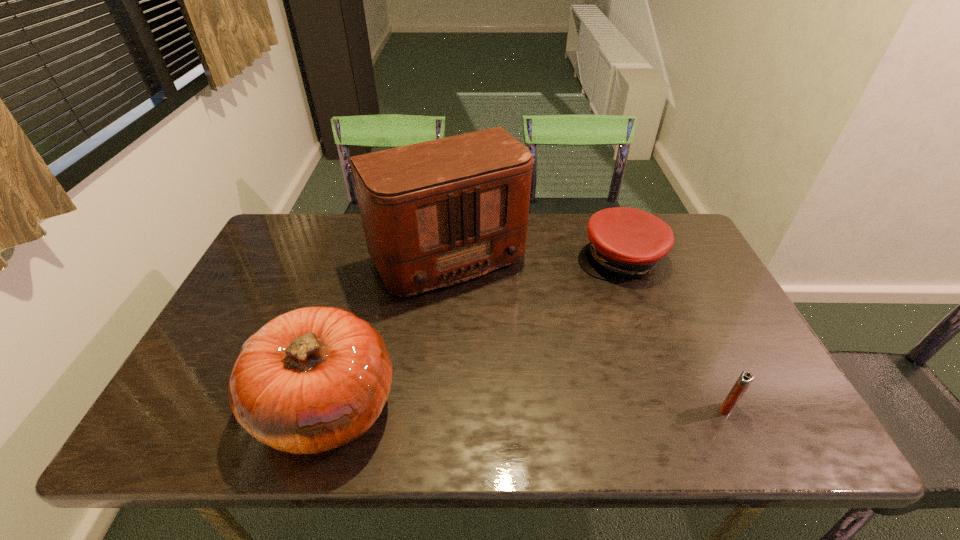
This screenshot has height=540, width=960. What are the coordinates of `pumpkin` in the screenshot? It's located at (311, 380).

Identify the location of igniter. (746, 378).

Find the location of a particular element. radio receiver is located at coordinates (436, 213).

At what (x,y) coordinates should I click in order to perform the action: click on cap. Please return your answer as a coordinate pair (x, y). Looking at the image, I should click on (625, 242).

At what (x,y) coordinates should I click in order to perform the action: click on vacant point located 0.180m on the back of the pumpkin. Please return your answer as a coordinate pair (x, y). Image resolution: width=960 pixels, height=540 pixels. Looking at the image, I should click on (359, 299).

Find the location of a particular element. Image resolution: width=960 pixels, height=540 pixels. vacant region located on the back of the igniter is located at coordinates (677, 300).

At what (x,y) coordinates should I click in order to perform the action: click on free space located 0.290m on the front panel of the tallest object. Please return your answer as a coordinate pair (x, y). Looking at the image, I should click on (531, 379).

Identify the location of vacant space located 0.240m on the front panel of the tallest object. (520, 363).

At what (x,y) coordinates should I click in order to perform the action: click on free space located on the front panel of the tallest object. Please return your answer as a coordinate pair (x, y). This screenshot has width=960, height=540. Looking at the image, I should click on (497, 329).

In order to click on vacant space located 0.400m at the front of the cap where the visor is located in this screenshot , I will do `click(584, 397)`.